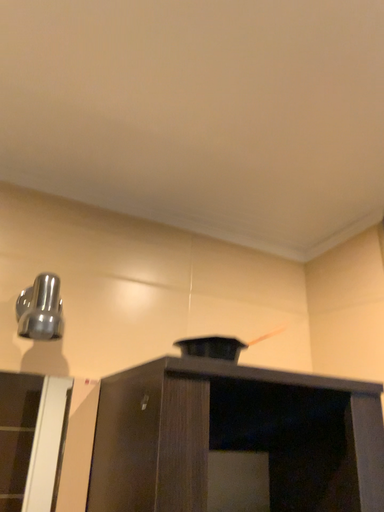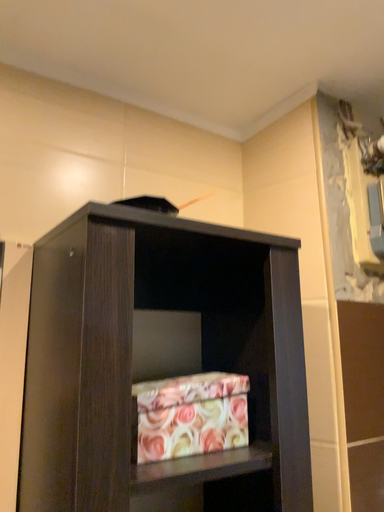
Question: Which way did the camera rotate in the video?

Choices:
 (A) rotated downward
 (B) rotated upward

Answer: (A)